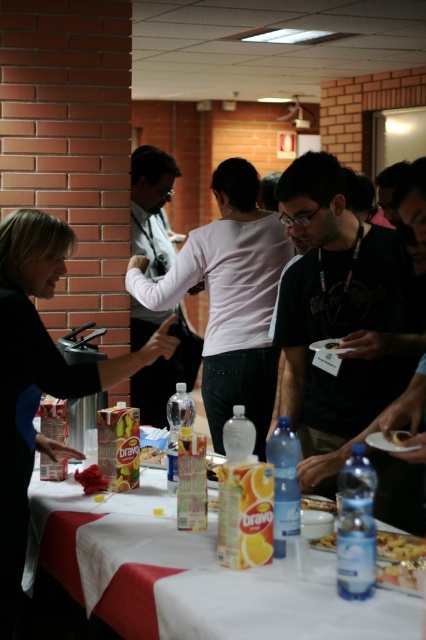
Is white paper table at center above golden crispy pizza at lower right?

No.

Is point (354, 608) positioned behind point (411, 548)?

No, (354, 608) is closer to viewer.

The width and height of the screenshot is (426, 640). In order to click on white paper table at center in this screenshot , I will do `click(189, 573)`.

Does golden crispy pizza at lower right appear over orange juice carton at table center?

Actually, golden crispy pizza at lower right is below orange juice carton at table center.

Is point (391, 552) in front of point (157, 451)?

That is True.

Where is `golden crispy pizza at lower right`? golden crispy pizza at lower right is located at coordinates (399, 545).

Can you confirm if black fabric shirt at left is taller than golden crispy pizza at lower right?

Indeed, black fabric shirt at left has a greater height compared to golden crispy pizza at lower right.

Does black fabric shirt at left come behind golden crispy pizza at lower right?

Yes, it is.

This screenshot has height=640, width=426. What do you see at coordinates (39, 376) in the screenshot?
I see `black fabric shirt at left` at bounding box center [39, 376].

At what (x,y) coordinates should I click in order to perform the action: click on black fabric shirt at left. Please return your answer as a coordinate pair (x, y). Looking at the image, I should click on (39, 376).